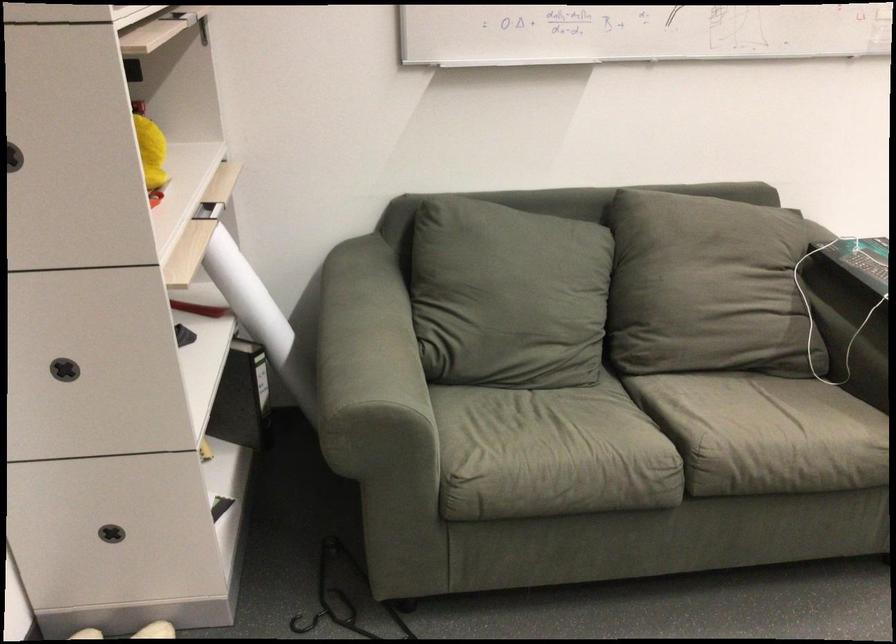
Where is `sofa armrest`? sofa armrest is located at coordinates click(x=358, y=342).